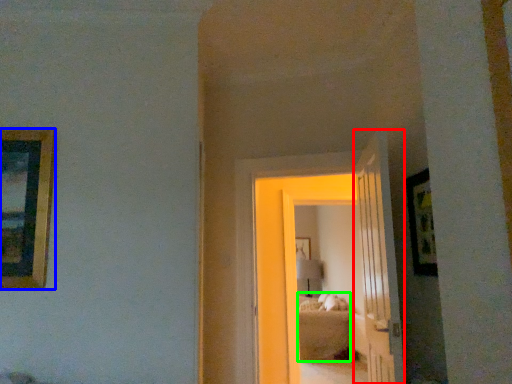
Question: Which object is positioned farthest from door (highlighted by a red box)? Select from picture frame (highlighted by a blue box) and bed (highlighted by a green box).

Choices:
 (A) picture frame
 (B) bed

Answer: (B)